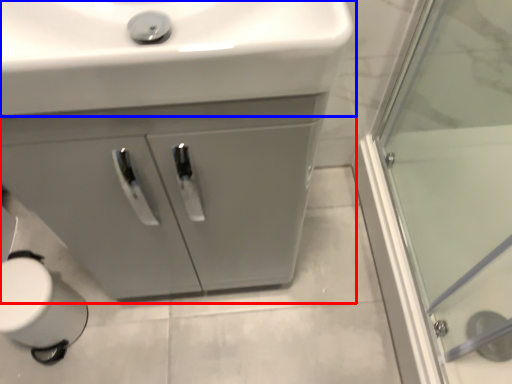
Question: Which point is closer to the camera, bathroom cabinet (highlighted by a red box) or sink (highlighted by a blue box)?

Choices:
 (A) bathroom cabinet
 (B) sink

Answer: (B)